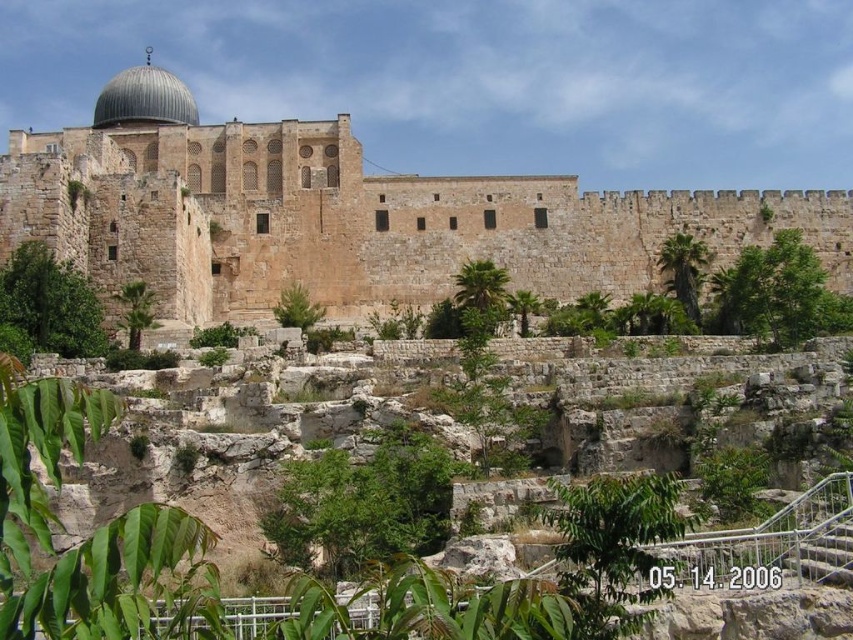
Is brown stone castle at upper center bigger than shiny silver dome at upper left?

Indeed, brown stone castle at upper center has a larger size compared to shiny silver dome at upper left.

Does brown stone castle at upper center have a greater height compared to shiny silver dome at upper left?

No, brown stone castle at upper center is not taller than shiny silver dome at upper left.

Does point (430, 289) come behind point (138, 81)?

No, it is in front of (138, 81).

Where is `brown stone castle at upper center`? This screenshot has height=640, width=853. brown stone castle at upper center is located at coordinates (352, 220).